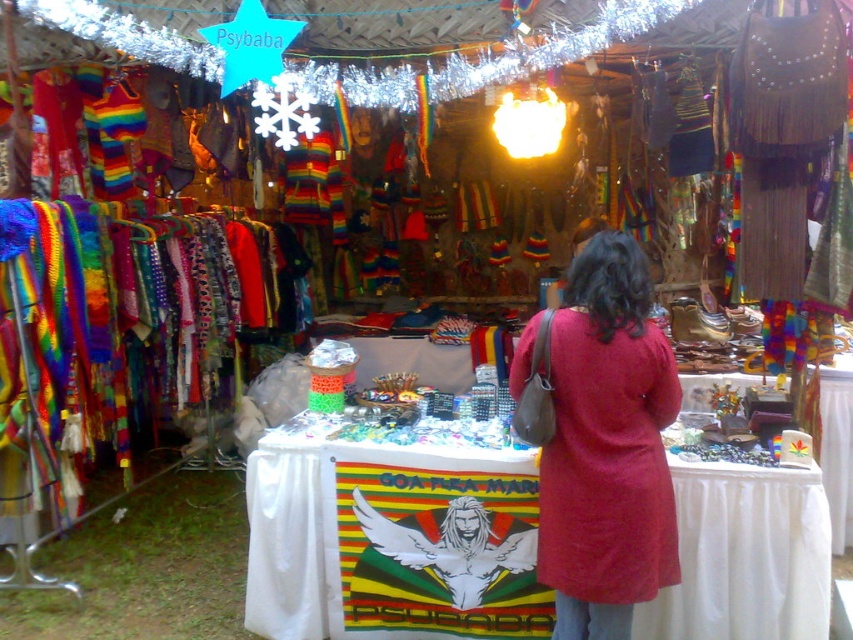
You are a customer at the market stall and want to see the matte red dress at center. However, the white cloth at center is blocking your view. Can you determine if the dress is visible from your current position?

The matte red dress at center is behind the white cloth at center, so it is not visible from your current position.

You are a customer at the market stall and want to buy both the white cloth at center and the matte red dress at center. You need to know which one is wider to determine if they can fit together in your bag. Can you tell me which one is wider?

The white cloth at center might be wider than matte red dress at center according to the description, so it is possible that the white cloth at center is wider. However, the description uses the word might, indicating uncertainty. Without exact measurements, it is not certain which is wider.